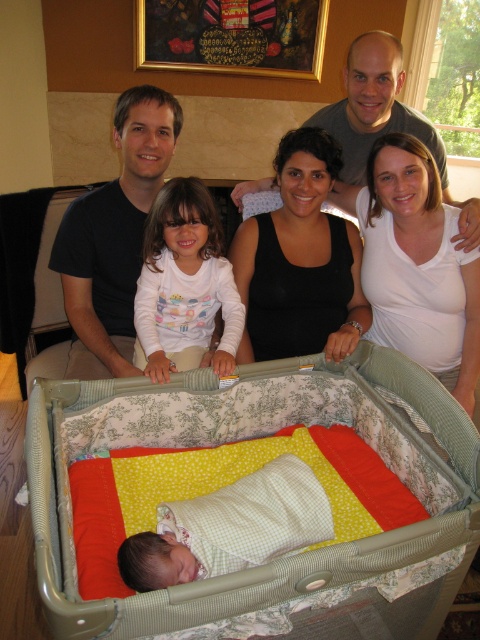
You are a photographer taking a picture of the baby in the bassinet. You notice two points marked in the scene. Which point, point 1 at coordinates (411, 196) or point 2 at coordinates (362, 108), is closer to the camera?

Point 1 at coordinates (411, 196) is closer to the camera than point 2 at coordinates (362, 108).

You are a photographer setting up a shoot in the living room. You need to position a light source to the right of the black matte dress at center and to the left of the matte white baby at lower center. Is this possible based on their current positions?

The black matte dress at center is to the left of the matte white baby at lower center, so placing a light source to the right of the black matte dress at center and to the left of the matte white baby at lower center is possible as they are positioned in a line from left to right.

You are a photographer taking a picture of the newborn baby in the bassinet. You notice there is a point at coordinate (400,195). Where exactly is this point located in the scene?

The point at coordinate (400,195) is located on the black matte dress at center.